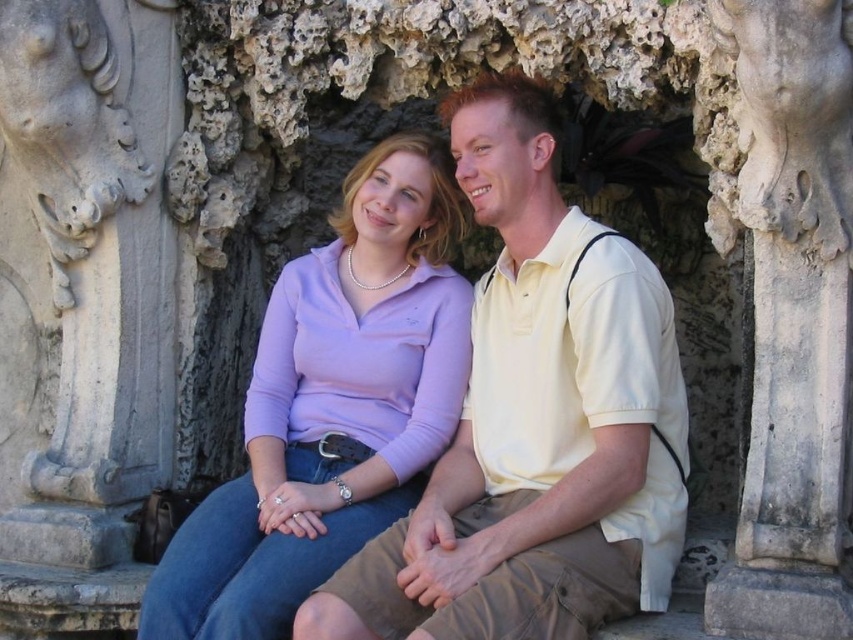
You are an artist trying to sketch this scene. You notice the matte yellow shirt at center and the white stone carving at center. Which object should you draw first if you want to focus on the wider element first?

The matte yellow shirt at center should be drawn first because its width is larger than the white stone carving at center, making it the wider element in the scene.

Based on the coordinates provided, which object is exactly at point (331, 404) in the image?

The matte purple shirt at center is exactly at point (331, 404) in the image.